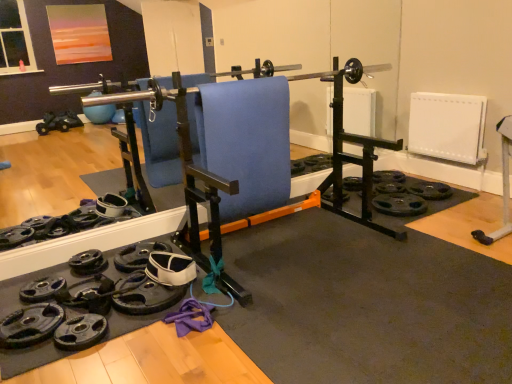
At what (x,y) coordinates should I click in order to perform the action: click on black rubber weight plate at lower left, the second wheel viewed from the left. Please return your answer as a coordinate pair (x, y). This screenshot has height=384, width=512. Looking at the image, I should click on (88, 263).

The image size is (512, 384). Find the location of `blue fabric swivel chair at center`. blue fabric swivel chair at center is located at coordinates (246, 142).

Identify the location of black rubber weight plate at lower left, the third wheel positioned from the right. coord(30,325).

Locate an element on the screen. The image size is (512, 384). black rubber weight plate at center, acting as the 3th wheel starting from the bottom is located at coordinates (352, 183).

The height and width of the screenshot is (384, 512). Find the location of `black rubber weight plate at lower left, the second wheel when ordered from top to bottom`. black rubber weight plate at lower left, the second wheel when ordered from top to bottom is located at coordinates (88, 263).

From a real-world perspective, between black rubber weight plate at lower left, the second wheel viewed from the left, and blue fabric swivel chair at center, who is vertically higher?

blue fabric swivel chair at center, from a real-world perspective.

From the image's perspective, which is below, black rubber weight plate at lower left, which is counted as the second wheel, starting from the right, or blue fabric swivel chair at center?

black rubber weight plate at lower left, which is counted as the second wheel, starting from the right, is shown below in the image.

Considering their positions, is black rubber weight plate at lower left, arranged as the second wheel when viewed from the back, located in front of or behind blue fabric swivel chair at center?

Answer: black rubber weight plate at lower left, arranged as the second wheel when viewed from the back, is positioned farther from the viewer than blue fabric swivel chair at center.

Which of these two, black rubber weight plate at lower left, the second wheel viewed from the left, or blue fabric swivel chair at center, is wider?

black rubber weight plate at lower left, the second wheel viewed from the left, is wider.

Which point is more distant from viewer, (359, 183) or (44, 339)?

The point (359, 183) is farther from the camera.

Considering the positions of objects black rubber weight plate at center, acting as the first wheel starting from the right, and black rubber weight plate at lower left, the third wheel positioned from the right, in the image provided, who is behind, black rubber weight plate at center, acting as the first wheel starting from the right, or black rubber weight plate at lower left, the third wheel positioned from the right,?

black rubber weight plate at center, acting as the first wheel starting from the right, is behind.

Which of these two, black rubber weight plate at center, placed as the third wheel when sorted from left to right, or black rubber weight plate at lower left, which is the first wheel in left-to-right order, is bigger?

With larger size is black rubber weight plate at lower left, which is the first wheel in left-to-right order.

Considering the sizes of black rubber weight plate at center, acting as the first wheel starting from the right, and black rubber weight plate at lower left, the third wheel positioned from the right, in the image, is black rubber weight plate at center, acting as the first wheel starting from the right, wider or thinner than black rubber weight plate at lower left, the third wheel positioned from the right,?

Clearly, black rubber weight plate at center, acting as the first wheel starting from the right, has less width compared to black rubber weight plate at lower left, the third wheel positioned from the right.

Is black rubber weight plate at lower left, the second wheel when ordered from top to bottom, beside black rubber weight plate at center, placed as the 3th wheel when sorted from front to back?

No, black rubber weight plate at lower left, the second wheel when ordered from top to bottom, is not with black rubber weight plate at center, placed as the 3th wheel when sorted from front to back.

From a real-world perspective, is black rubber weight plate at lower left, which is counted as the second wheel, starting from the right, physically located above or below black rubber weight plate at center, acting as the first wheel starting from the right?

black rubber weight plate at lower left, which is counted as the second wheel, starting from the right, is below black rubber weight plate at center, acting as the first wheel starting from the right.

Considering the relative sizes of black rubber weight plate at lower left, the second wheel viewed from the left, and black rubber weight plate at center, the 1th wheel viewed from the back, in the image provided, is black rubber weight plate at lower left, the second wheel viewed from the left, bigger than black rubber weight plate at center, the 1th wheel viewed from the back,?

Yes, black rubber weight plate at lower left, the second wheel viewed from the left, is bigger than black rubber weight plate at center, the 1th wheel viewed from the back.

From their relative heights in the image, would you say black rubber weight plate at lower left, arranged as the second wheel when ordered from the bottom, is taller or shorter than black rubber weight plate at center, placed as the third wheel when sorted from left to right?

In the image, black rubber weight plate at lower left, arranged as the second wheel when ordered from the bottom, appears to be taller than black rubber weight plate at center, placed as the third wheel when sorted from left to right.

Between black rubber weight plate at lower left, which is counted as the 3th wheel, starting from the back, and black rubber weight plate at lower left, arranged as the second wheel when viewed from the back, which one appears on the left side from the viewer's perspective?

black rubber weight plate at lower left, which is counted as the 3th wheel, starting from the back, is more to the left.

Consider the image. Is black rubber weight plate at lower left, the third wheel positioned from the right, next to black rubber weight plate at lower left, which is counted as the second wheel, starting from the right?

No, black rubber weight plate at lower left, the third wheel positioned from the right, is not in contact with black rubber weight plate at lower left, which is counted as the second wheel, starting from the right.

Is black rubber weight plate at lower left, the 1th wheel in the bottom-to-top sequence, facing away from black rubber weight plate at lower left, arranged as the second wheel when ordered from the bottom?

That's right, black rubber weight plate at lower left, the 1th wheel in the bottom-to-top sequence, is facing away from black rubber weight plate at lower left, arranged as the second wheel when ordered from the bottom.

From the image's perspective, relative to black rubber weight plate at lower left, which is counted as the second wheel, starting from the right, is black rubber weight plate at center, placed as the third wheel when sorted from left to right, above or below?

Clearly, from the image's perspective, black rubber weight plate at center, placed as the third wheel when sorted from left to right, is above black rubber weight plate at lower left, which is counted as the second wheel, starting from the right.

Are black rubber weight plate at center, placed as the third wheel when sorted from left to right, and black rubber weight plate at lower left, the second wheel viewed from the left, making contact?

black rubber weight plate at center, placed as the third wheel when sorted from left to right, and black rubber weight plate at lower left, the second wheel viewed from the left, are not in contact.

From a real-world perspective, is black rubber weight plate at center, acting as the first wheel starting from the right, on top of black rubber weight plate at lower left, which is the second wheel from front to back?

Yes, from a real-world perspective, black rubber weight plate at center, acting as the first wheel starting from the right, is over black rubber weight plate at lower left, which is the second wheel from front to back

Does point (349, 180) appear closer or farther from the camera than point (71, 270)?

Point (349, 180) appears to be farther away from the viewer than point (71, 270).

Can you see blue fabric swivel chair at center touching black rubber weight plate at lower left, the 1th wheel in the bottom-to-top sequence?

No.

Consider the image. Can you tell me how much blue fabric swivel chair at center and black rubber weight plate at lower left, which is counted as the 3th wheel, starting from the back, differ in facing direction?

0.000417 degrees.

The image size is (512, 384). What are the coordinates of `the 2nd wheel counting from the left of the blue fabric swivel chair at center` in the screenshot? It's located at point(30,325).

You are a GUI agent. You are given a task and a screenshot of the screen. Output one action in this format:
    pyautogui.click(x=<x>, y=<y>)
    Task: Click on the swivel chair that is on the right side of black rubber weight plate at lower left, the third wheel in the top-to-bottom sequence
    The height and width of the screenshot is (384, 512).
    Given the screenshot: What is the action you would take?
    pyautogui.click(x=246, y=142)

Is black rubber weight plate at lower left, which is the first wheel in left-to-right order, in front of blue fabric swivel chair at center?

Yes.

From the image's perspective, is black rubber weight plate at lower left, which is counted as the first wheel, starting from the front, located above blue fabric swivel chair at center?

No, from the image's perspective, black rubber weight plate at lower left, which is counted as the first wheel, starting from the front, is not over blue fabric swivel chair at center.

Starting from the blue fabric swivel chair at center, which wheel is the 1st one to the left? Please provide its 2D coordinates.

[(88, 263)]

Where is `the 2nd wheel positioned below the black rubber weight plate at center, acting as the 3th wheel starting from the bottom (from the image's perspective)`? The height and width of the screenshot is (384, 512). the 2nd wheel positioned below the black rubber weight plate at center, acting as the 3th wheel starting from the bottom (from the image's perspective) is located at coordinates (30, 325).

Considering their positions, is black rubber weight plate at center, acting as the 3th wheel starting from the bottom, positioned closer to blue fabric swivel chair at center than black rubber weight plate at lower left, the second wheel when ordered from top to bottom?

The object closer to blue fabric swivel chair at center is black rubber weight plate at lower left, the second wheel when ordered from top to bottom.

Based on their spatial positions, is black rubber weight plate at center, the first wheel positioned from the top, or blue fabric swivel chair at center further from black rubber weight plate at lower left, the third wheel positioned from the right?

Based on the image, black rubber weight plate at center, the first wheel positioned from the top, appears to be further to black rubber weight plate at lower left, the third wheel positioned from the right.

Which object lies nearer to the anchor point black rubber weight plate at lower left, arranged as the second wheel when ordered from the bottom, blue fabric swivel chair at center or black rubber weight plate at center, acting as the 3th wheel starting from the bottom?

blue fabric swivel chair at center lies closer to black rubber weight plate at lower left, arranged as the second wheel when ordered from the bottom, than the other object.

When comparing their distances from black rubber weight plate at lower left, which is counted as the first wheel, starting from the front, does blue fabric swivel chair at center or black rubber weight plate at lower left, the second wheel when ordered from top to bottom, seem further?

blue fabric swivel chair at center is positioned further to the anchor black rubber weight plate at lower left, which is counted as the first wheel, starting from the front.

Based on their spatial positions, is black rubber weight plate at lower left, the third wheel in the top-to-bottom sequence, or blue fabric swivel chair at center further from black rubber weight plate at center, the 1th wheel viewed from the back?

black rubber weight plate at lower left, the third wheel in the top-to-bottom sequence, is further to black rubber weight plate at center, the 1th wheel viewed from the back.

Considering their positions, is blue fabric swivel chair at center positioned further to black rubber weight plate at lower left, arranged as the second wheel when viewed from the back, than black rubber weight plate at lower left, which is counted as the 3th wheel, starting from the back?

Among the two, blue fabric swivel chair at center is located further to black rubber weight plate at lower left, arranged as the second wheel when viewed from the back.

Looking at the image, which one is located closer to blue fabric swivel chair at center, black rubber weight plate at lower left, which is the first wheel in left-to-right order, or black rubber weight plate at center, the first wheel positioned from the top?

black rubber weight plate at center, the first wheel positioned from the top, is closer to blue fabric swivel chair at center.

Estimate the real-world distances between objects in this image. Which object is closer to black rubber weight plate at center, placed as the 3th wheel when sorted from front to back, black rubber weight plate at lower left, which is counted as the 3th wheel, starting from the back, or black rubber weight plate at lower left, arranged as the second wheel when viewed from the back?

Among the two, black rubber weight plate at lower left, arranged as the second wheel when viewed from the back, is located nearer to black rubber weight plate at center, placed as the 3th wheel when sorted from front to back.

The image size is (512, 384). I want to click on swivel chair between black rubber weight plate at lower left, which is counted as the second wheel, starting from the right, and black rubber weight plate at center, the 1th wheel viewed from the back, from left to right, so click(x=246, y=142).

Where is `wheel between black rubber weight plate at lower left, which is counted as the first wheel, starting from the front, and black rubber weight plate at center, the 1th wheel viewed from the back, in the horizontal direction`? Image resolution: width=512 pixels, height=384 pixels. wheel between black rubber weight plate at lower left, which is counted as the first wheel, starting from the front, and black rubber weight plate at center, the 1th wheel viewed from the back, in the horizontal direction is located at coordinates (88, 263).

This screenshot has height=384, width=512. What are the coordinates of `wheel located between black rubber weight plate at lower left, the third wheel positioned from the right, and blue fabric swivel chair at center in the left-right direction` in the screenshot? It's located at (88, 263).

The image size is (512, 384). In order to click on swivel chair situated between black rubber weight plate at lower left, which is counted as the 3th wheel, starting from the back, and black rubber weight plate at center, the first wheel positioned from the top, from left to right in this screenshot , I will do `click(246, 142)`.